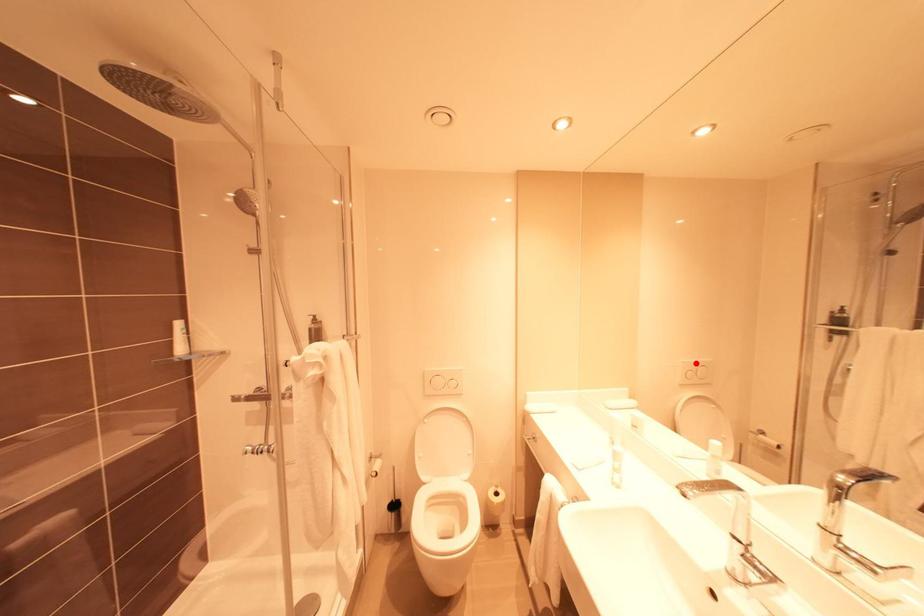
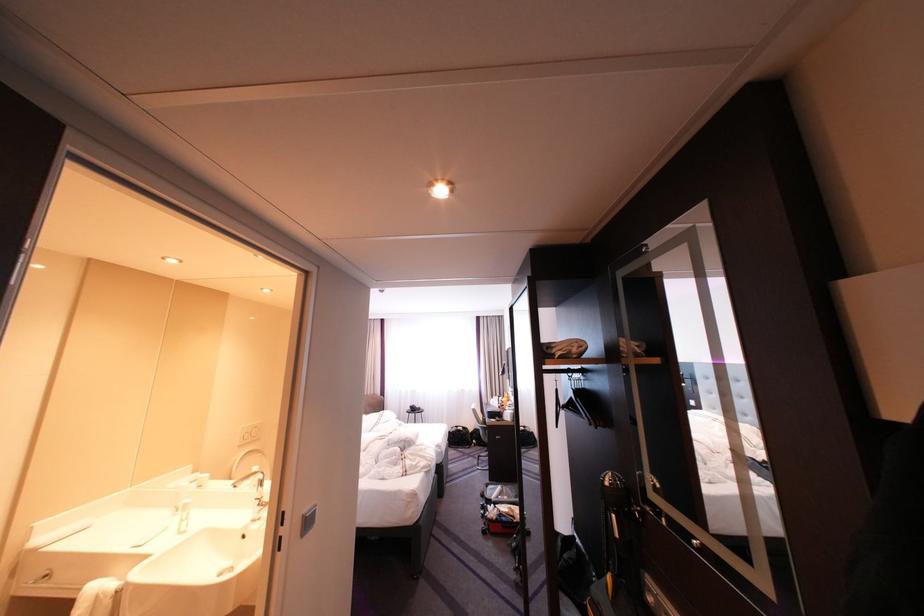
Locate, in the second image, the point that corresponds to the highlighted location in the first image.

(254, 429)